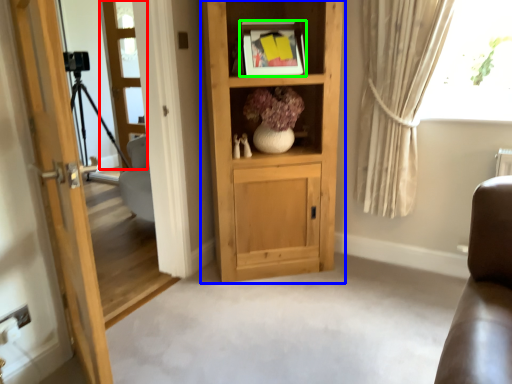
Question: Estimate the real-world distances between objects in this image. Which object is farther from screen door (highlighted by a red box), cabinetry (highlighted by a blue box) or picture frame (highlighted by a green box)?

Choices:
 (A) cabinetry
 (B) picture frame

Answer: (A)